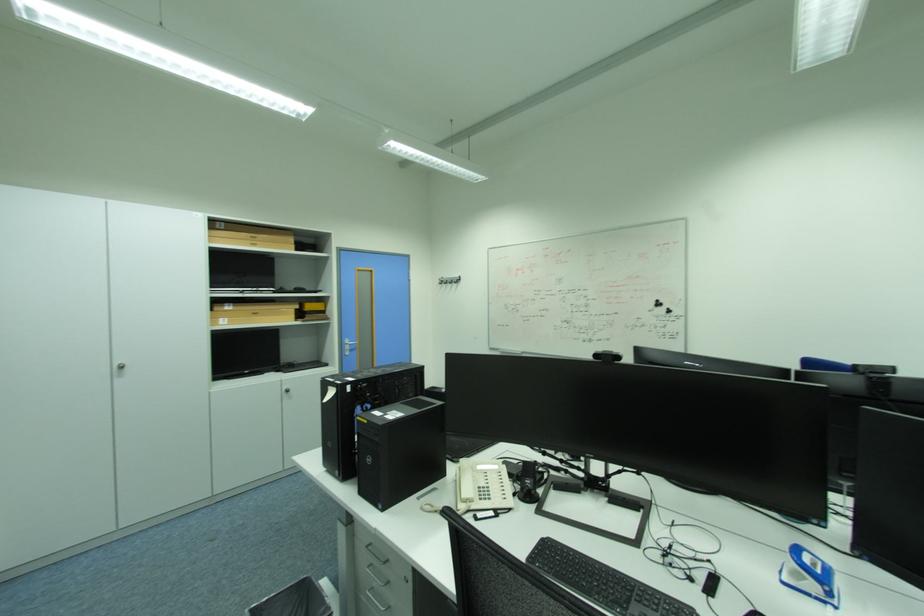
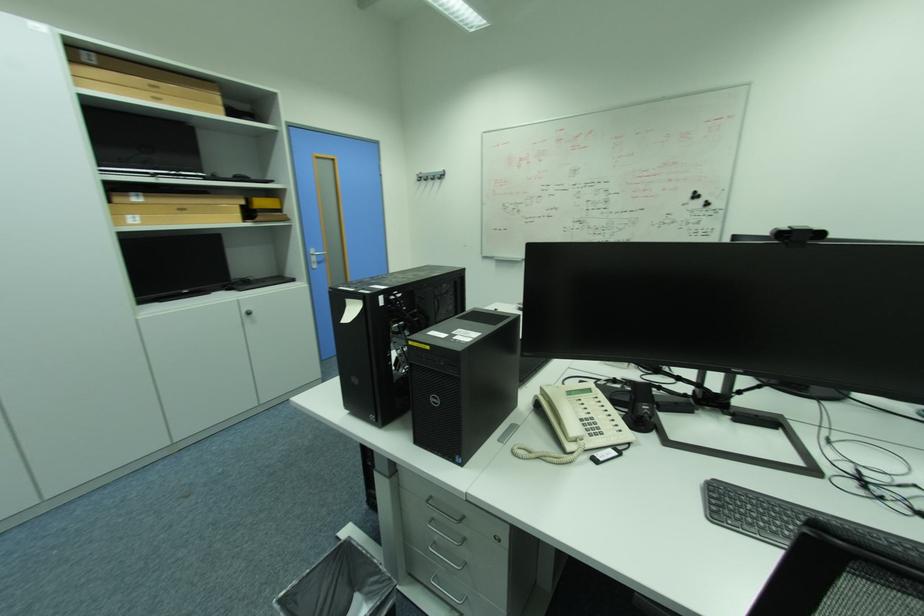
In the second image, find the point that corresponds to (x=355, y=347) in the first image.

(321, 260)